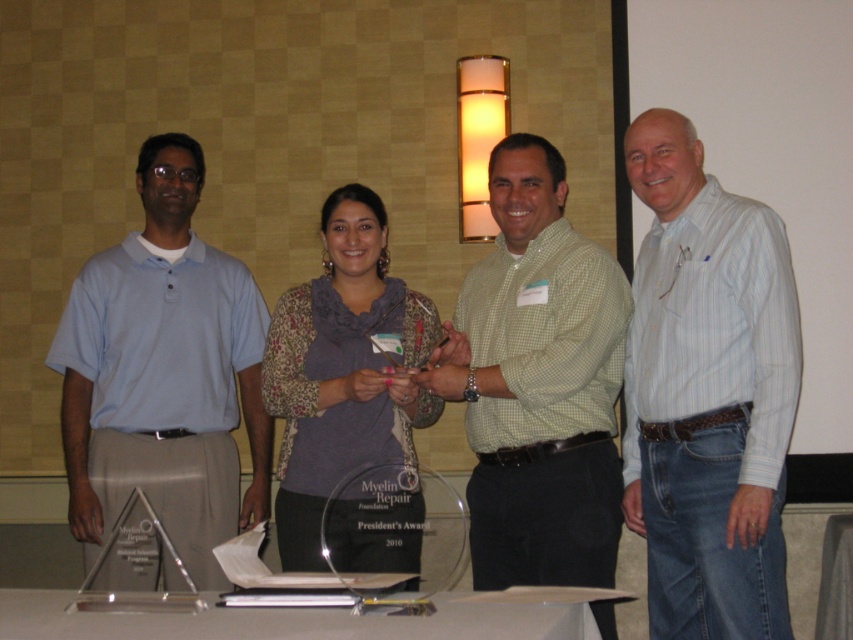
Is light blue polo shirt at left behind clear acrylic table at center?

Yes, light blue polo shirt at left is further from the viewer.

Is point (90, 284) more distant than point (190, 628)?

Yes, it is behind point (190, 628).

Which is behind, point (111, 406) or point (93, 636)?

Point (111, 406)

Where is `light blue polo shirt at left`? The image size is (853, 640). light blue polo shirt at left is located at coordinates (163, 374).

Does floral-patterned sweater at center come behind clear acrylic table at center?

Yes, floral-patterned sweater at center is behind clear acrylic table at center.

Consider the image. Does floral-patterned sweater at center appear on the left side of clear acrylic table at center?

Incorrect, floral-patterned sweater at center is not on the left side of clear acrylic table at center.

At what (x,y) coordinates should I click in order to perform the action: click on floral-patterned sweater at center. Please return your answer as a coordinate pair (x, y). Looking at the image, I should click on (343, 369).

Where is `floral-patterned sweater at center`? floral-patterned sweater at center is located at coordinates (343, 369).

Is the position of green checkered shirt at center more distant than that of floral-patterned sweater at center?

Yes, green checkered shirt at center is behind floral-patterned sweater at center.

Is green checkered shirt at center above floral-patterned sweater at center?

Yes.

Who is more forward, (567, 515) or (340, 291)?

Point (567, 515) is in front.

You are a GUI agent. You are given a task and a screenshot of the screen. Output one action in this format:
    pyautogui.click(x=<x>, y=<y>)
    Task: Click on the green checkered shirt at center
    The height and width of the screenshot is (640, 853).
    Given the screenshot: What is the action you would take?
    pyautogui.click(x=537, y=384)